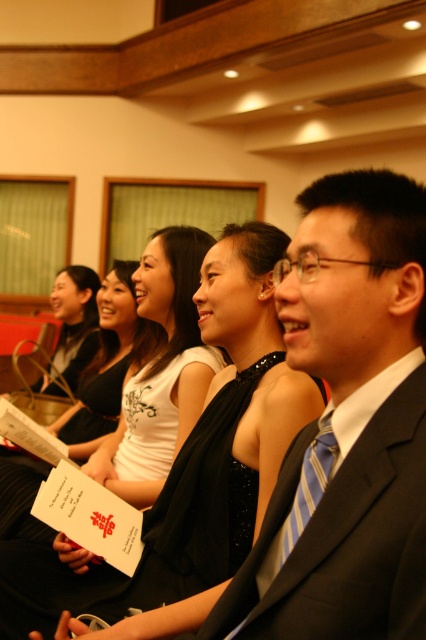
You are an event planner arranging decorations for the upcoming formal gathering. You need to place a decorative ribbon along the edge of the white matte paper at center and the blue striped tie at right. Which object requires a longer ribbon due to its greater width?

The white matte paper at center requires a longer ribbon because its width surpasses that of the blue striped tie at right.

From the picture: You are a photographer trying to capture a group photo of the dark gray suit at center and the blue striped tie at right. If you want to ensure both are fully visible in the frame, which object should you focus on first to avoid cropping?

The dark gray suit at center is wider than the blue striped tie at right, so you should focus on ensuring the dark gray suit at center is fully framed first to avoid cropping.

You are at a formal event and see the dark gray suit at center and the white matte paper at center. Which object is positioned to the right?

The dark gray suit at center is positioned to the right of the white matte paper at center.